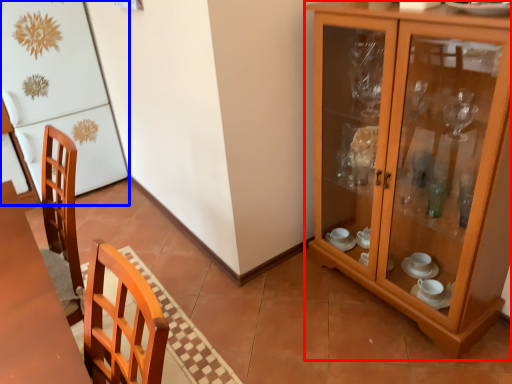
Question: Which object appears closest to the camera in this image, cabinetry (highlighted by a red box) or fridge (highlighted by a blue box)?

Choices:
 (A) cabinetry
 (B) fridge

Answer: (A)